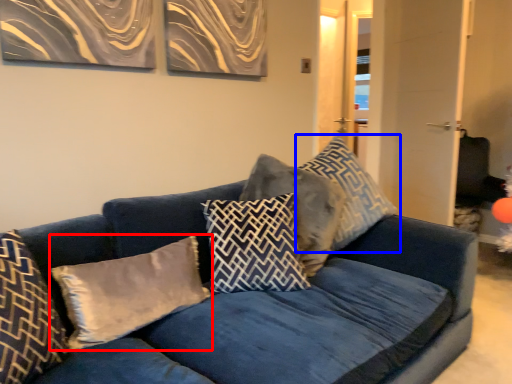
Question: Which object is closer to the camera taking this photo, pillow (highlighted by a red box) or pillow (highlighted by a blue box)?

Choices:
 (A) pillow
 (B) pillow

Answer: (A)